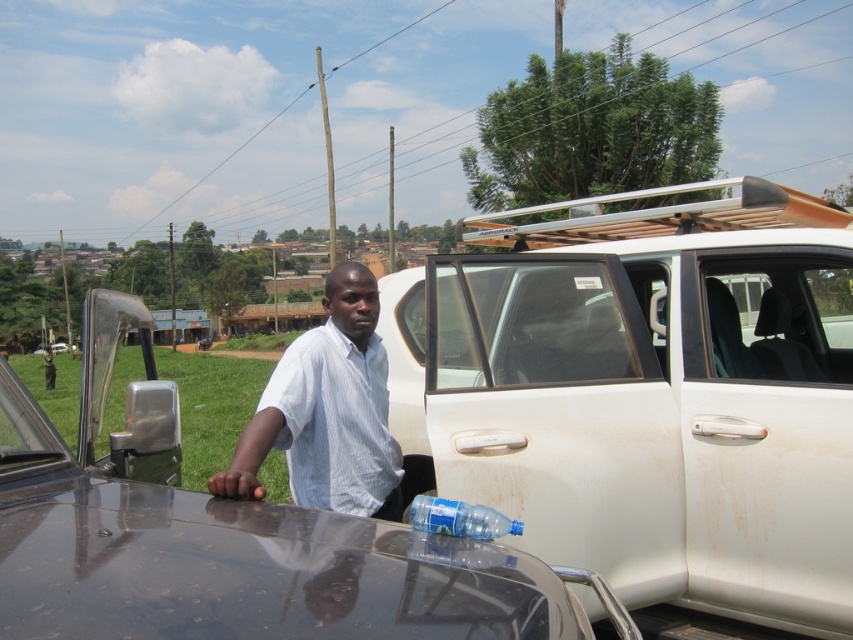
Consider the image. You are a photographer trying to capture both the white striped shirt at center and the translucent blue plastic bottle at lower center in a single frame. Given their sizes, which object should you focus on to ensure both are clearly visible in the photo?

The white striped shirt at center is bigger than the translucent blue plastic bottle at lower center. To ensure both are clearly visible, focus on the white striped shirt at center as it requires more space in the frame, and the smaller bottle will naturally fit within the composition.